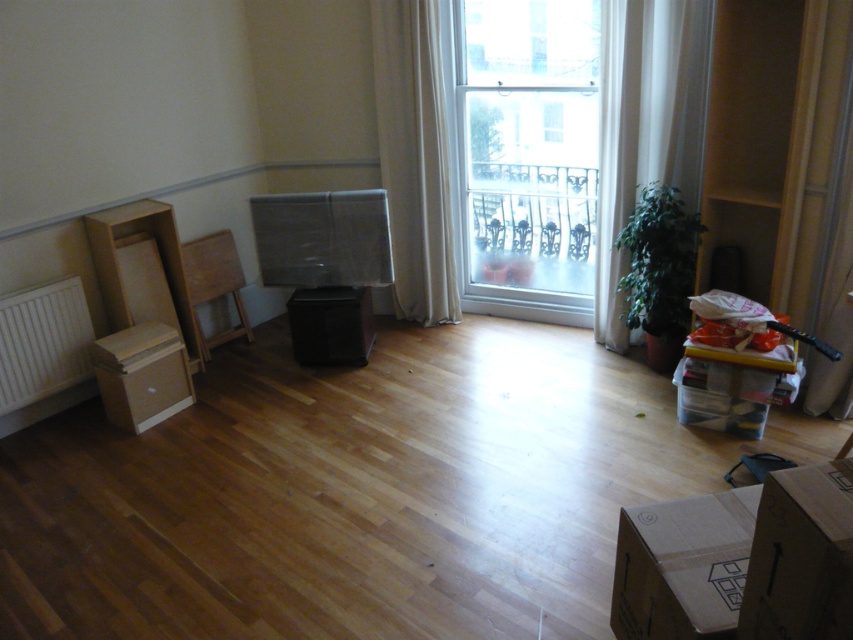
Question: In this image, where is white sheer curtain at right located relative to white fabric curtain at upper right?

Choices:
 (A) above
 (B) below

Answer: (B)

Question: Which point is closer to the camera taking this photo?

Choices:
 (A) (643, 32)
 (B) (576, 72)
 (C) (682, 566)
 (D) (816, 284)

Answer: (C)

Question: Which point is farther from the camera taking this photo?

Choices:
 (A) coord(24,333)
 (B) coord(390,17)

Answer: (B)

Question: Is green fabric curtain at right bigger than brown cardboard box at lower left?

Choices:
 (A) yes
 (B) no

Answer: (A)

Question: Does white sheer curtain at right come in front of white fabric curtain at upper right?

Choices:
 (A) no
 (B) yes

Answer: (B)

Question: Which is farther from the white fabric curtain at upper right?

Choices:
 (A) brown cardboard box at lower right
 (B) clear glass window at center

Answer: (A)